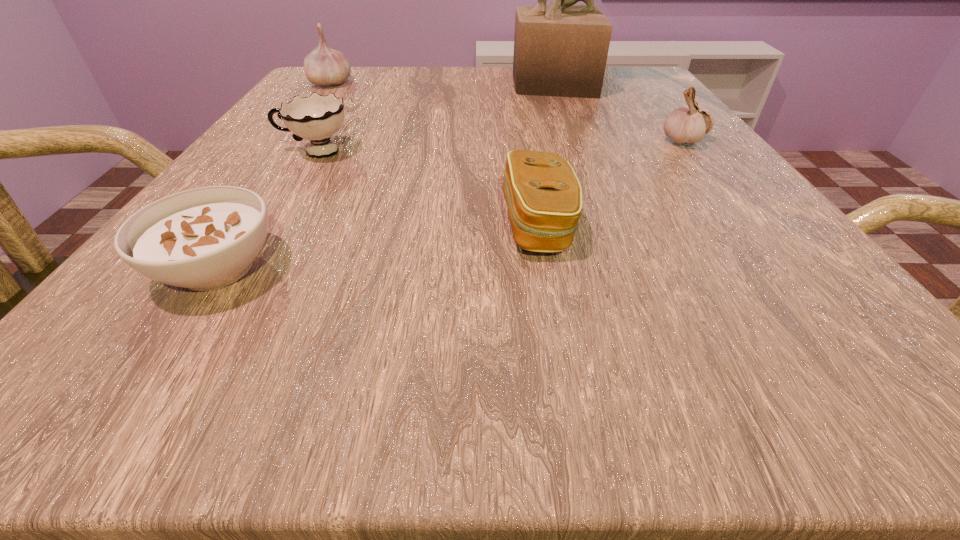
At what (x,y) coordinates should I click in order to perform the action: click on free spot that satisfies the following two spatial constraints: 1. on the front-facing side of the tallest object; 2. on the back side of the shorter garlic. Please return your answer as a coordinate pair (x, y). This screenshot has width=960, height=540. Looking at the image, I should click on (571, 141).